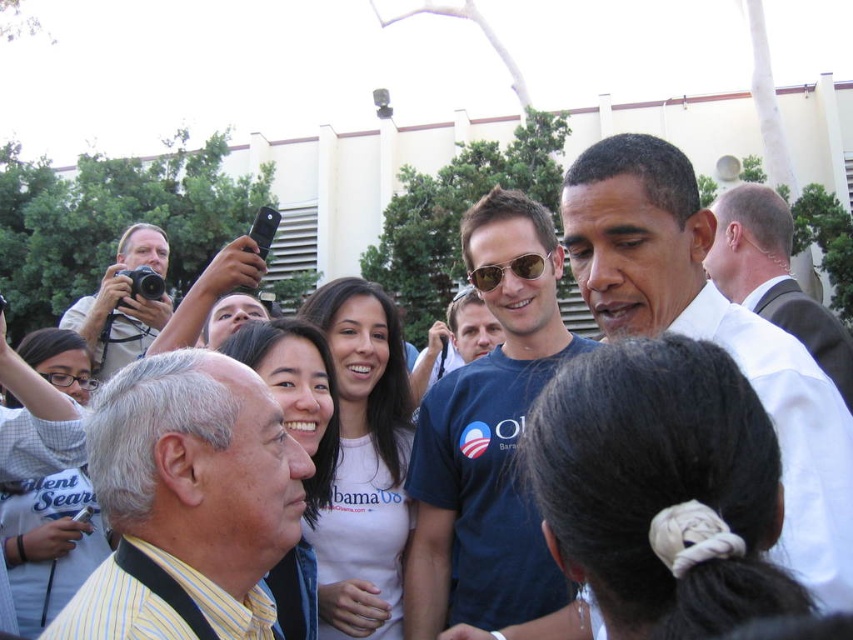
Question: Is white shirt at upper right wider than blue t-shirt at center?

Choices:
 (A) yes
 (B) no

Answer: (A)

Question: Is yellow striped shirt at center positioned at the back of blue t-shirt at center?

Choices:
 (A) yes
 (B) no

Answer: (B)

Question: Which of the following is the closest to the observer?

Choices:
 (A) yellow striped shirt at center
 (B) blue t-shirt at center
 (C) sunglasses at center
 (D) white shirt at center

Answer: (D)

Question: Which is nearer to the sunglasses at center?

Choices:
 (A) white shirt at upper right
 (B) blue t-shirt at center
 (C) dark blue t-shirt at center
 (D) yellow striped shirt at center

Answer: (C)

Question: Is yellow striped shirt at center wider than matte black camera at upper left?

Choices:
 (A) no
 (B) yes

Answer: (A)

Question: Which object is positioned farthest from the blue t-shirt at center?

Choices:
 (A) dark blue t-shirt at center
 (B) white shirt at center

Answer: (B)